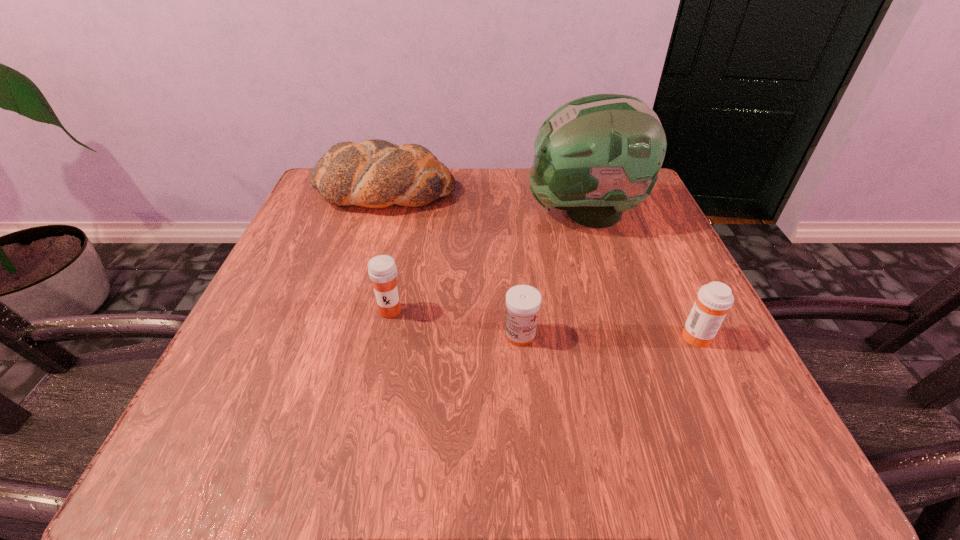
What are the coordinates of `vacant position located on the front of the bread` in the screenshot? It's located at (339, 341).

Where is `vacant space located 0.150m on the label side of the third farthest object`? The width and height of the screenshot is (960, 540). vacant space located 0.150m on the label side of the third farthest object is located at coordinates (372, 400).

Find the location of a particular element. The width and height of the screenshot is (960, 540). free point located 0.310m on the left of the rightmost medicine is located at coordinates (486, 335).

Locate an element on the screen. The height and width of the screenshot is (540, 960). free spot located 0.270m on the back of the third object from right to left is located at coordinates (511, 226).

The image size is (960, 540). I want to click on football helmet present at the far edge, so click(x=596, y=156).

Find the location of a particular element. The image size is (960, 540). bread that is at the far edge is located at coordinates (375, 173).

The image size is (960, 540). I want to click on object located at the left edge, so click(375, 173).

In order to click on football helmet that is positioned at the right edge in this screenshot , I will do `click(596, 156)`.

The height and width of the screenshot is (540, 960). Find the location of `medicine present at the right edge`. medicine present at the right edge is located at coordinates (713, 301).

Locate an element on the screen. The height and width of the screenshot is (540, 960). object at the far left corner is located at coordinates (375, 173).